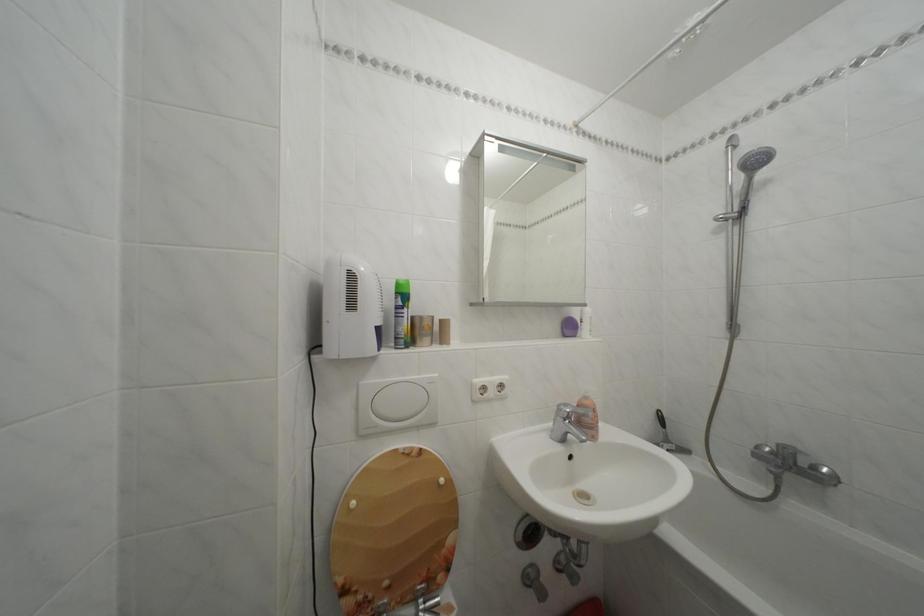
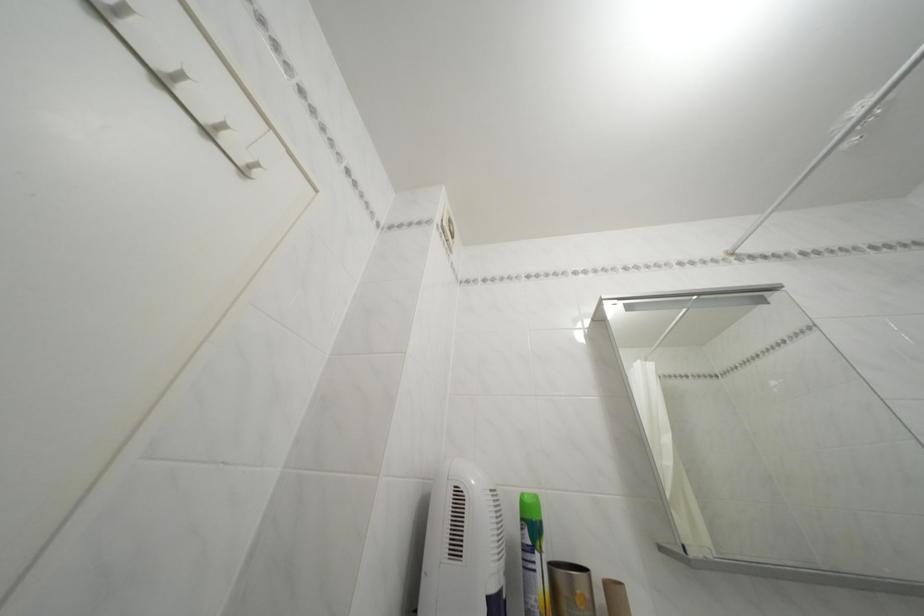
Find the pixel in the second image that matches [406,300] in the first image.

(531, 525)